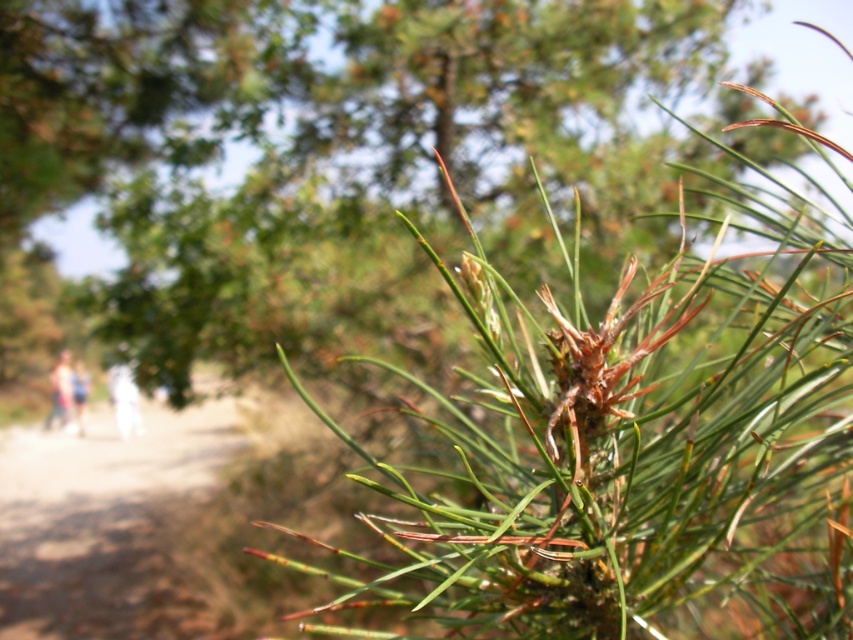
You are a hiker wearing white cotton pants at lower left and you see a brown dirt trail at lower left. Which one is larger in size?

The brown dirt trail at lower left is bigger than white cotton pants at lower left.

You are a hiker wearing white cotton pants at left and want to walk along the brown dirt trail at lower left. Based on the scene, can your pants avoid getting dirty from the trail?

The brown dirt trail at lower left is taller than white cotton pants at left, so the trail is higher than the pants. Since the trail is elevated, the pants are less likely to touch the dirt and get dirty.